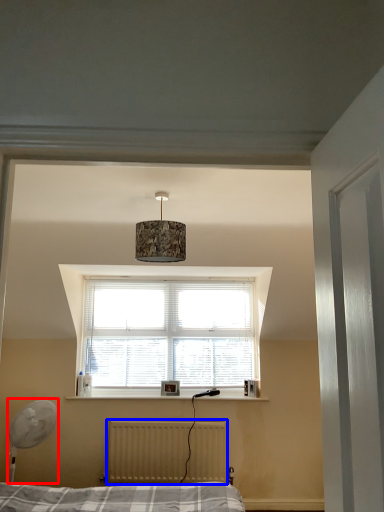
Question: Which object is closer to the camera taking this photo, table lamp (highlighted by a red box) or radiator (highlighted by a blue box)?

Choices:
 (A) table lamp
 (B) radiator

Answer: (A)